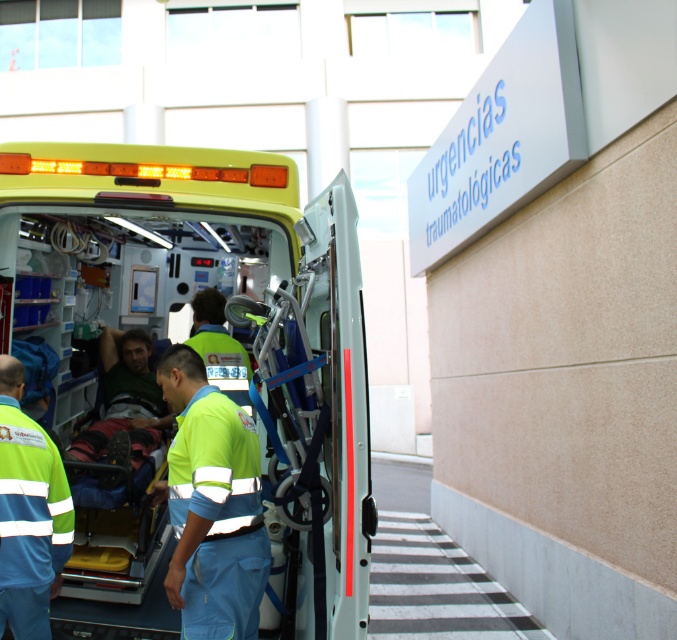
Can you confirm if yellow matte ambulance at center is thinner than green fabric shirt at center?

Incorrect, yellow matte ambulance at center's width is not less than green fabric shirt at center's.

How much distance is there between yellow matte ambulance at center and green fabric shirt at center?

A distance of 19.99 inches exists between yellow matte ambulance at center and green fabric shirt at center.

Describe the element at coordinates (198, 296) in the screenshot. I see `yellow matte ambulance at center` at that location.

At what (x,y) coordinates should I click in order to perform the action: click on yellow matte ambulance at center. Please return your answer as a coordinate pair (x, y). This screenshot has height=640, width=677. Looking at the image, I should click on (198, 296).

Is point (93, 216) positioned in front of point (20, 456)?

That is False.

Is point (169, 426) closer to camera compared to point (9, 394)?

No, (169, 426) is behind (9, 394).

Where is `yellow matte ambulance at center`? This screenshot has width=677, height=640. yellow matte ambulance at center is located at coordinates (198, 296).

Does point (26, 506) come in front of point (141, 392)?

Yes, it is in front of point (141, 392).

Identify the location of green reflective uniform at center. (28, 513).

The height and width of the screenshot is (640, 677). What do you see at coordinates (28, 513) in the screenshot?
I see `green reflective uniform at center` at bounding box center [28, 513].

Identify the location of green reflective uniform at center. Image resolution: width=677 pixels, height=640 pixels. (28, 513).